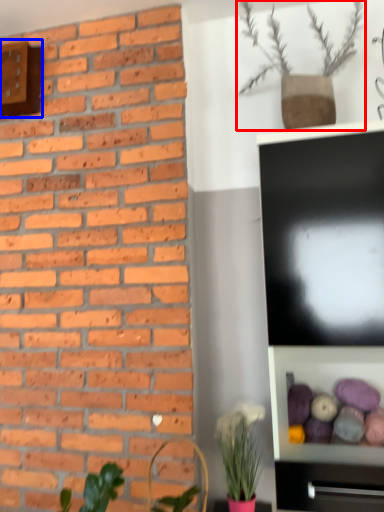
Question: Which of the following is the closest to the observer, houseplant (highlighted by a red box) or clock (highlighted by a blue box)?

Choices:
 (A) houseplant
 (B) clock

Answer: (A)